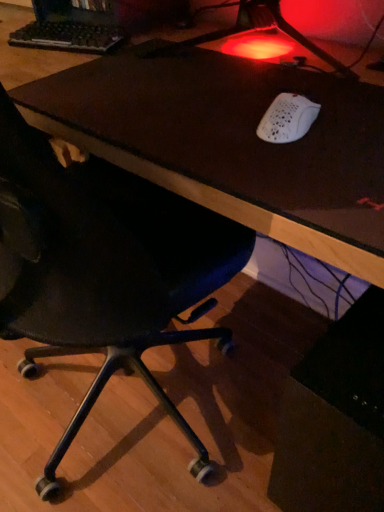
The width and height of the screenshot is (384, 512). I want to click on free space above brown leather desk at center (from a real-world perspective), so click(195, 75).